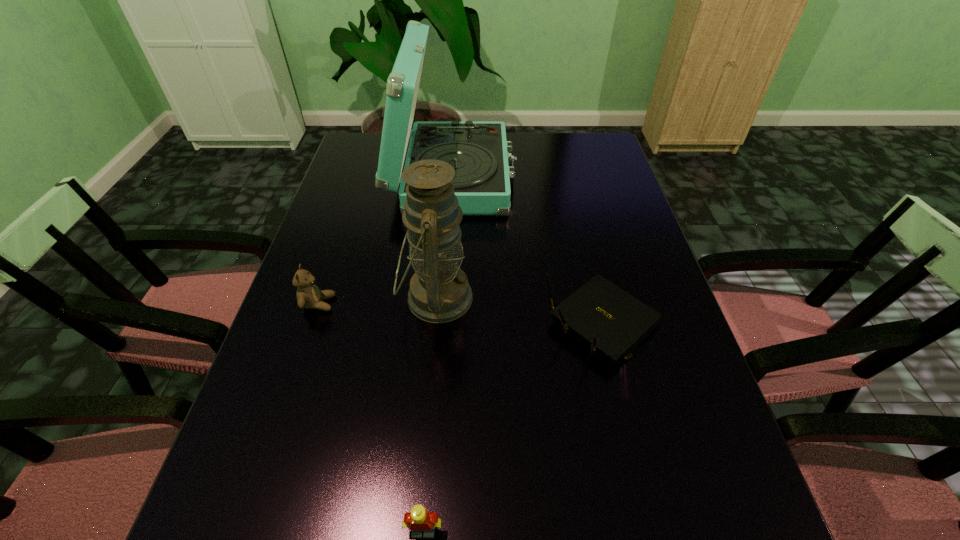
You are a GUI agent. You are given a task and a screenshot of the screen. Output one action in this format:
    pyautogui.click(x=<x>, y=<y>)
    Task: Click on the free area in between the farthest object and the teddy bear
    
    Given the screenshot: What is the action you would take?
    pyautogui.click(x=386, y=240)

Locate an element on the screen. Image resolution: width=960 pixels, height=540 pixels. vacant space in between the nearest object and the teddy bear is located at coordinates (371, 417).

Where is `unoccupied area between the farthest object and the leftmost object`? This screenshot has height=540, width=960. unoccupied area between the farthest object and the leftmost object is located at coordinates click(x=386, y=240).

Image resolution: width=960 pixels, height=540 pixels. I want to click on free spot between the router and the farthest object, so click(x=528, y=249).

Locate an element on the screen. The image size is (960, 540). vacant point located between the nearest object and the leftmost object is located at coordinates (371, 417).

The image size is (960, 540). I want to click on empty space between the oil lamp and the nearest object, so click(430, 414).

I want to click on vacant space that's between the router and the Lego, so click(514, 427).

Locate an element on the screen. The height and width of the screenshot is (540, 960). free area in between the oil lamp and the nearest object is located at coordinates (430, 414).

The width and height of the screenshot is (960, 540). I want to click on the closest object to the oil lamp, so click(x=309, y=296).

Where is `object that stands as the third closest to the record player`? Image resolution: width=960 pixels, height=540 pixels. object that stands as the third closest to the record player is located at coordinates (309, 296).